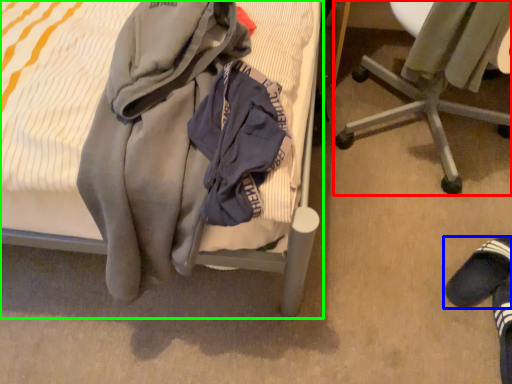
Question: Which object is the farthest from chair (highlighted by a red box)? Choose among these: footwear (highlighted by a blue box) or bed (highlighted by a green box).

Choices:
 (A) footwear
 (B) bed

Answer: (B)